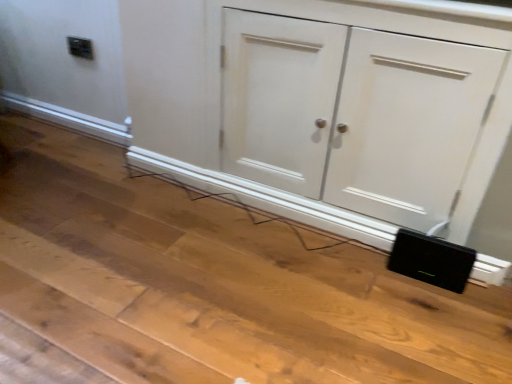
Question: Is black matte speaker at lower right outside of white matte cupboard at lower right?

Choices:
 (A) yes
 (B) no

Answer: (A)

Question: From the image's perspective, is black matte speaker at lower right beneath white matte cupboard at lower right?

Choices:
 (A) yes
 (B) no

Answer: (A)

Question: Is black matte speaker at lower right facing towards white matte cupboard at lower right?

Choices:
 (A) yes
 (B) no

Answer: (B)

Question: Is the surface of black matte speaker at lower right in direct contact with white matte cupboard at lower right?

Choices:
 (A) yes
 (B) no

Answer: (B)

Question: Does black matte speaker at lower right come in front of white matte cupboard at lower right?

Choices:
 (A) yes
 (B) no

Answer: (B)

Question: Is there a large distance between black matte speaker at lower right and white matte cupboard at lower right?

Choices:
 (A) yes
 (B) no

Answer: (B)

Question: From the image's perspective, is white matte cupboard at lower right above black plastic electric outlet at upper left?

Choices:
 (A) no
 (B) yes

Answer: (A)

Question: From a real-world perspective, is white matte cupboard at lower right on black plastic electric outlet at upper left?

Choices:
 (A) no
 (B) yes

Answer: (A)

Question: Is white matte cupboard at lower right with black plastic electric outlet at upper left?

Choices:
 (A) yes
 (B) no

Answer: (B)

Question: Is black plastic electric outlet at upper left surrounded by white matte cupboard at lower right?

Choices:
 (A) yes
 (B) no

Answer: (B)

Question: From a real-world perspective, is white matte cupboard at lower right beneath black plastic electric outlet at upper left?

Choices:
 (A) yes
 (B) no

Answer: (A)

Question: Can you confirm if white matte cupboard at lower right is positioned to the right of black plastic electric outlet at upper left?

Choices:
 (A) yes
 (B) no

Answer: (A)

Question: Does white matte cupboard at lower right appear on the right side of black matte speaker at lower right?

Choices:
 (A) no
 (B) yes

Answer: (A)